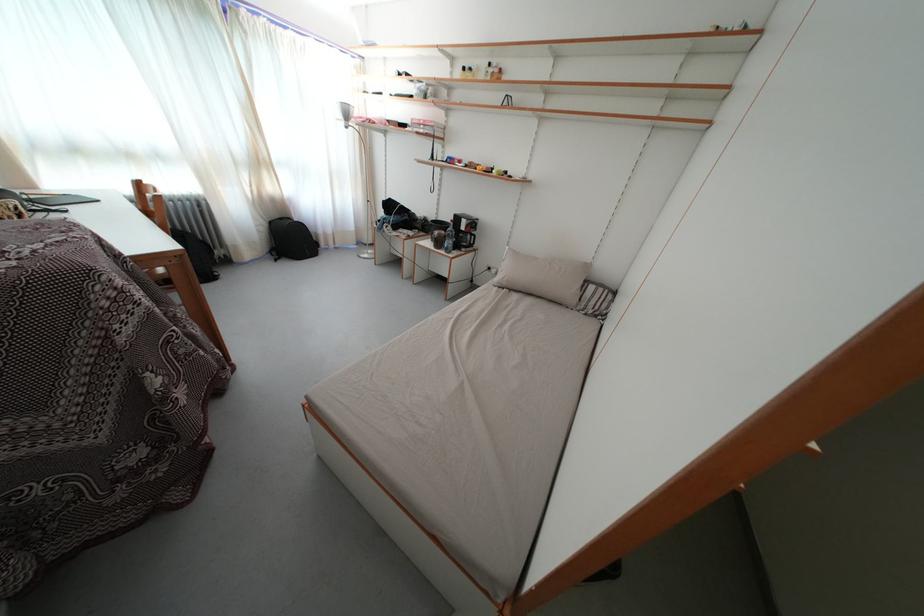
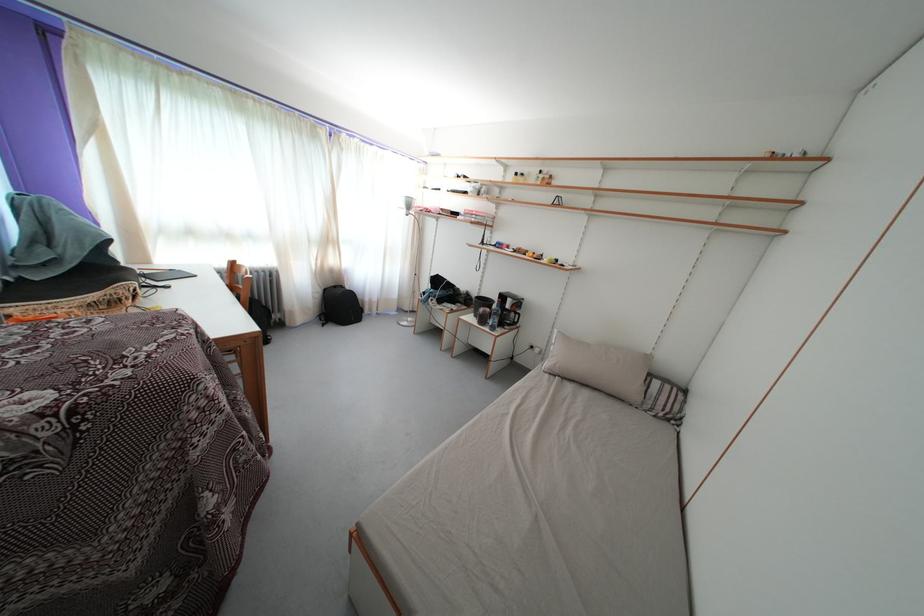
Question: In a continuous first-person perspective shot, in which direction is the camera moving?

Choices:
 (A) Left
 (B) Right
 (C) Forward
 (D) Backward

Answer: (A)